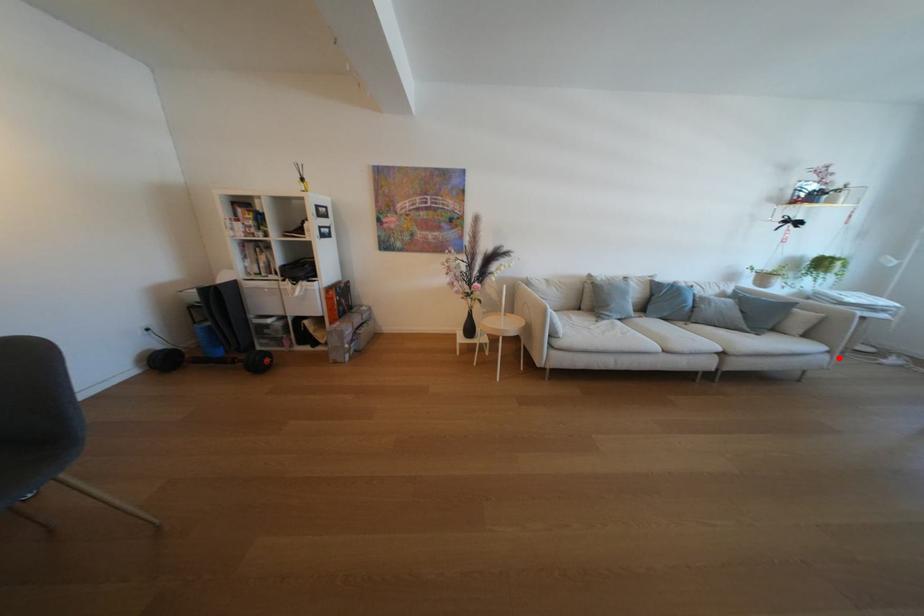
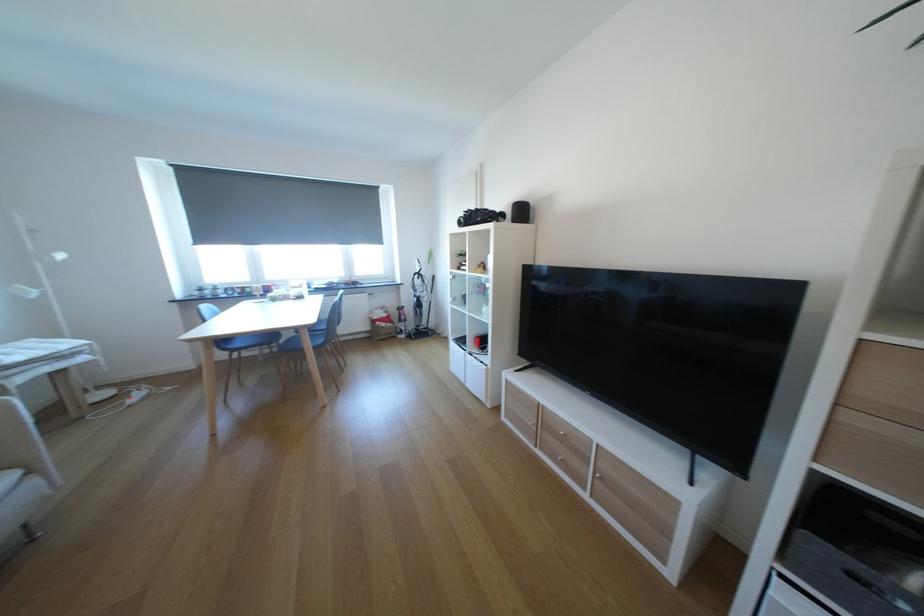
Question: A red point is marked in image1. In image2, is the corresponding 3D point closer to the camera or farther? Reply with the corresponding letter.

Choices:
 (A) The corresponding 3D point is closer.
 (B) The corresponding 3D point is farther.

Answer: (B)